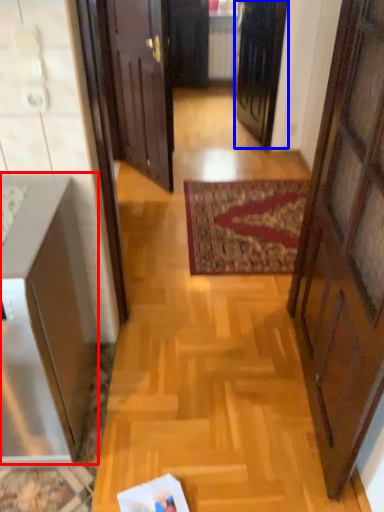
Question: Which of the following is the closest to the observer, cabinetry (highlighted by a red box) or door (highlighted by a blue box)?

Choices:
 (A) cabinetry
 (B) door

Answer: (A)